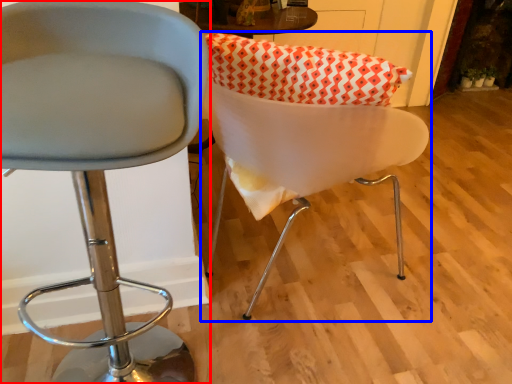
Question: Which point is closer to the camera, chair (highlighted by a red box) or chair (highlighted by a blue box)?

Choices:
 (A) chair
 (B) chair

Answer: (A)